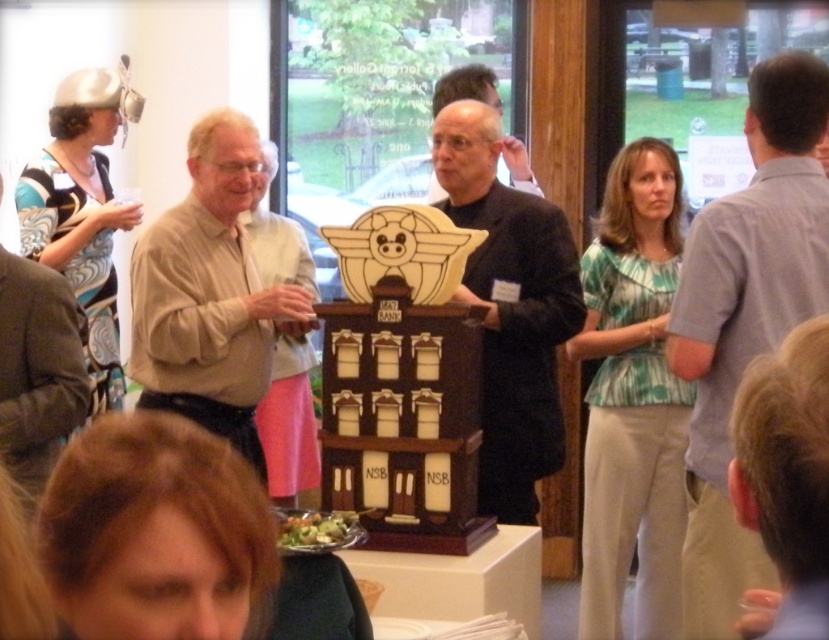
What do you see at coordinates (745, 316) in the screenshot?
I see `gray cotton shirt at upper right` at bounding box center [745, 316].

Is gray cotton shirt at upper right to the right of brown leather jacket at upper left from the viewer's perspective?

Correct, you'll find gray cotton shirt at upper right to the right of brown leather jacket at upper left.

Find the location of a particular element. The height and width of the screenshot is (640, 829). gray cotton shirt at upper right is located at coordinates (745, 316).

Can you confirm if gray cotton shirt at upper right is bigger than dark brown suit at center?

No.

Is point (725, 413) positioned in front of point (539, 230)?

Yes.

Is point (709, 385) more distant than point (478, 136)?

No, it is in front of (478, 136).

Where is `gray cotton shirt at upper right`? gray cotton shirt at upper right is located at coordinates pyautogui.click(x=745, y=316).

Can you confirm if brown leather jacket at upper left is thinner than matte black man at center?

No.

Who is shorter, brown leather jacket at upper left or matte black man at center?

Standing shorter between the two is matte black man at center.

Is point (61, 385) closer to camera compared to point (527, 156)?

Yes, point (61, 385) is in front of point (527, 156).

Find the location of a particular element. This screenshot has width=829, height=640. brown leather jacket at upper left is located at coordinates (37, 371).